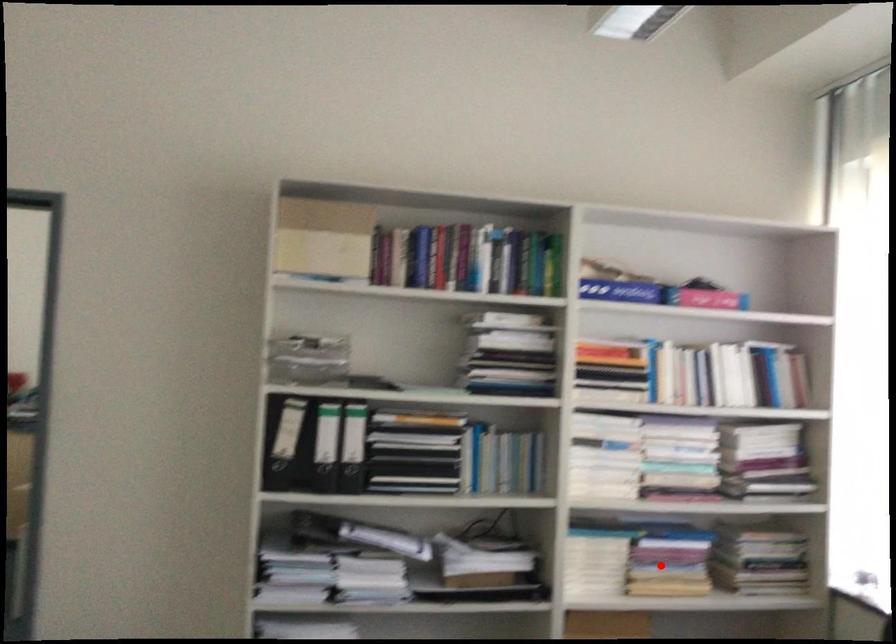
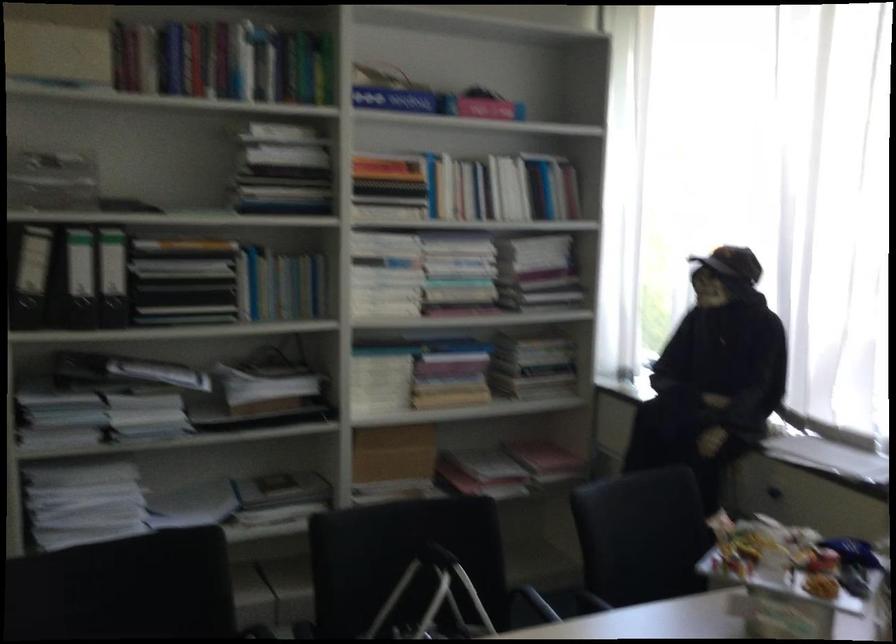
In the second image, find the point that corresponds to the highlighted location in the first image.

(442, 374)